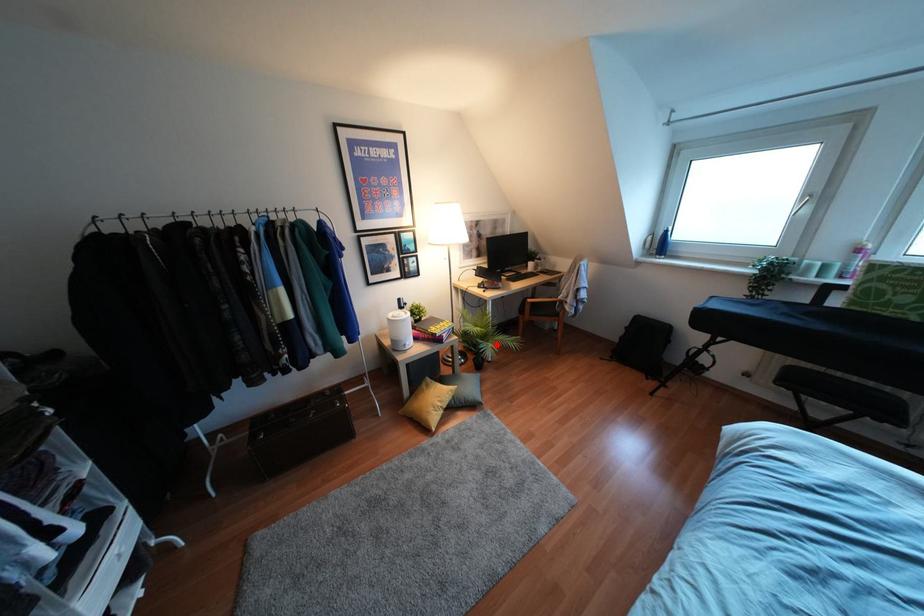
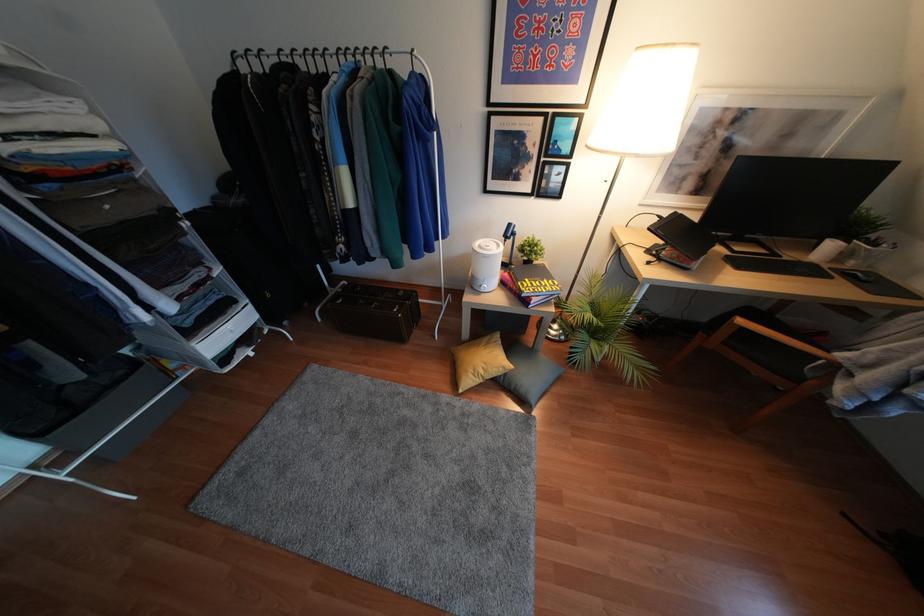
In the second image, find the point that corresponds to the highlighted location in the first image.

(604, 357)